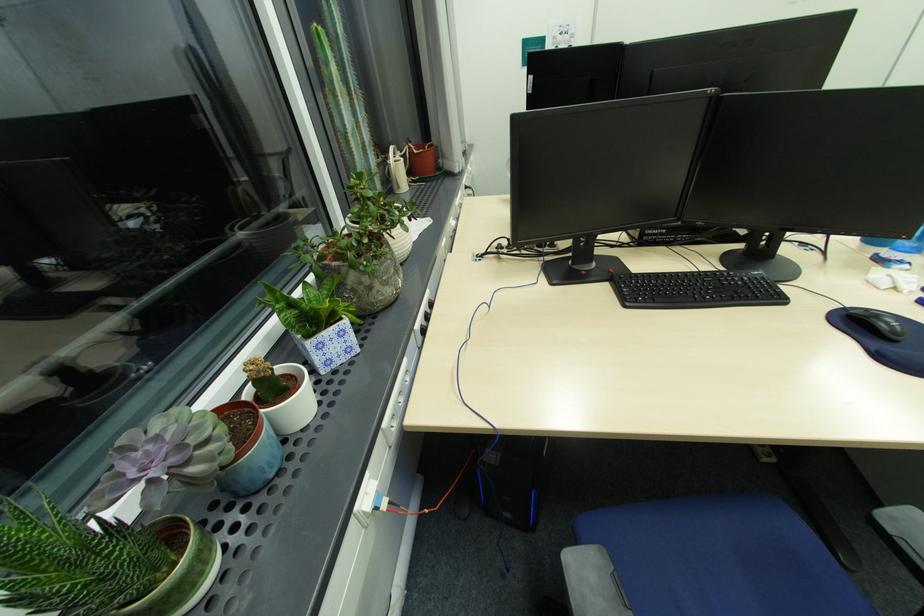
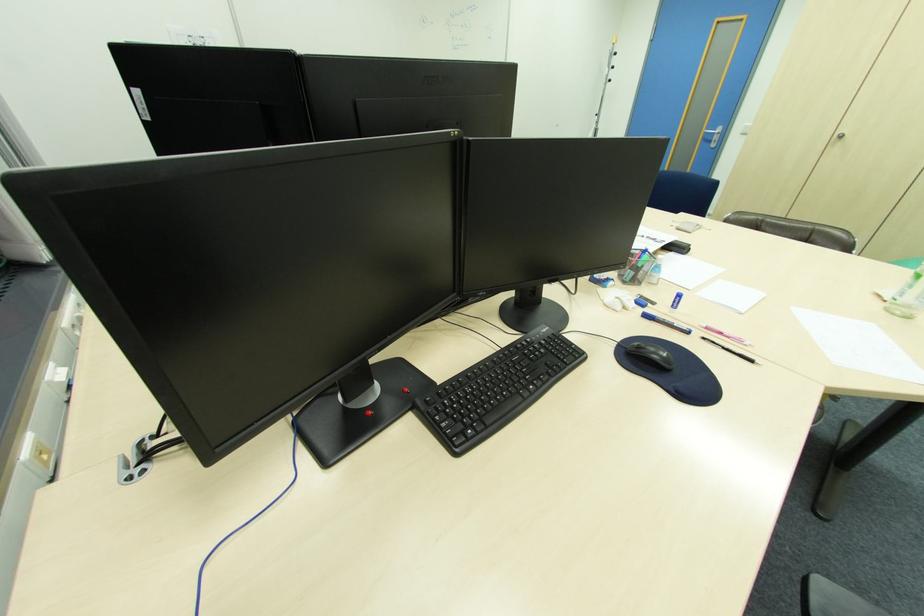
Locate, in the second image, the point that corresponds to (888,326) in the first image.

(662, 358)